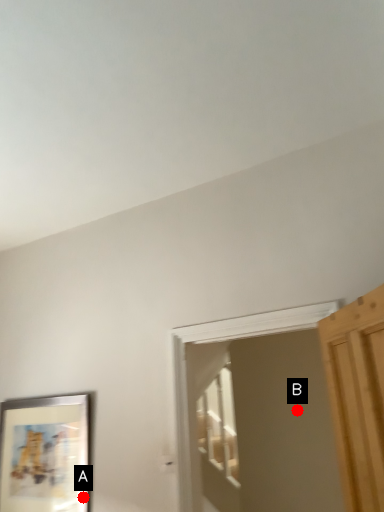
Question: Two points are circled on the image, labeled by A and B beside each circle. Which point appears closest to the camera in this image?

Choices:
 (A) A is closer
 (B) B is closer

Answer: (A)